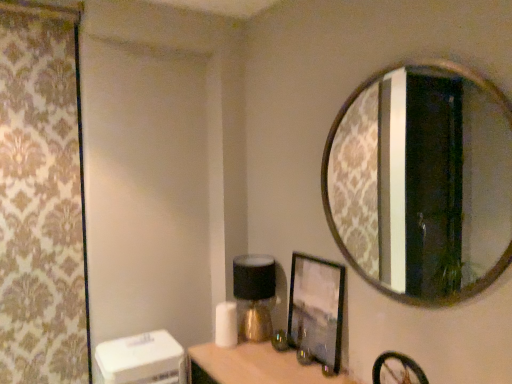
Question: Is matte black picture frame at center oriented towards patterned fabric curtain at left?

Choices:
 (A) no
 (B) yes

Answer: (A)

Question: Is matte black picture frame at center far from patterned fabric curtain at left?

Choices:
 (A) no
 (B) yes

Answer: (B)

Question: Does matte black picture frame at center come in front of patterned fabric curtain at left?

Choices:
 (A) no
 (B) yes

Answer: (B)

Question: From the image's perspective, would you say matte black picture frame at center is positioned over patterned fabric curtain at left?

Choices:
 (A) no
 (B) yes

Answer: (A)

Question: Considering the relative sizes of matte black picture frame at center and patterned fabric curtain at left in the image provided, is matte black picture frame at center shorter than patterned fabric curtain at left?

Choices:
 (A) yes
 (B) no

Answer: (A)

Question: From a real-world perspective, is matte black picture frame at center physically located above or below matte gold table lamp at center?

Choices:
 (A) below
 (B) above

Answer: (B)

Question: Based on their sizes in the image, would you say matte black picture frame at center is bigger or smaller than matte gold table lamp at center?

Choices:
 (A) big
 (B) small

Answer: (B)

Question: Considering the positions of point (312, 291) and point (253, 317), is point (312, 291) closer or farther from the camera than point (253, 317)?

Choices:
 (A) farther
 (B) closer

Answer: (B)

Question: In terms of height, does matte black picture frame at center look taller or shorter compared to matte gold table lamp at center?

Choices:
 (A) tall
 (B) short

Answer: (A)

Question: In terms of height, does patterned fabric curtain at left look taller or shorter compared to gold-framed mirror at upper right?

Choices:
 (A) tall
 (B) short

Answer: (A)

Question: In the image, is patterned fabric curtain at left on the left side or the right side of gold-framed mirror at upper right?

Choices:
 (A) left
 (B) right

Answer: (A)

Question: Is patterned fabric curtain at left situated inside gold-framed mirror at upper right or outside?

Choices:
 (A) inside
 (B) outside

Answer: (B)

Question: From a real-world perspective, is patterned fabric curtain at left physically located above or below gold-framed mirror at upper right?

Choices:
 (A) below
 (B) above

Answer: (A)

Question: In terms of size, does matte gold table lamp at center appear bigger or smaller than gold-framed mirror at upper right?

Choices:
 (A) big
 (B) small

Answer: (B)

Question: In terms of height, does matte gold table lamp at center look taller or shorter compared to gold-framed mirror at upper right?

Choices:
 (A) tall
 (B) short

Answer: (B)